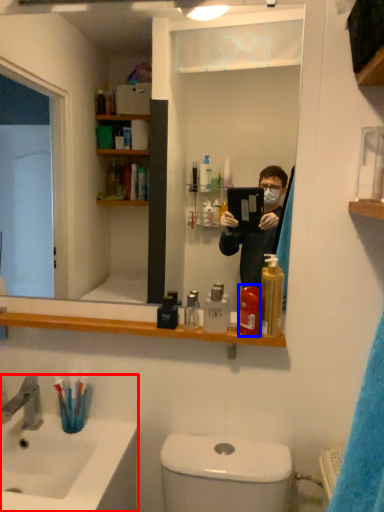
Question: Among these objects, which one is farthest to the camera, sink (highlighted by a red box) or mouthwash (highlighted by a blue box)?

Choices:
 (A) sink
 (B) mouthwash

Answer: (B)